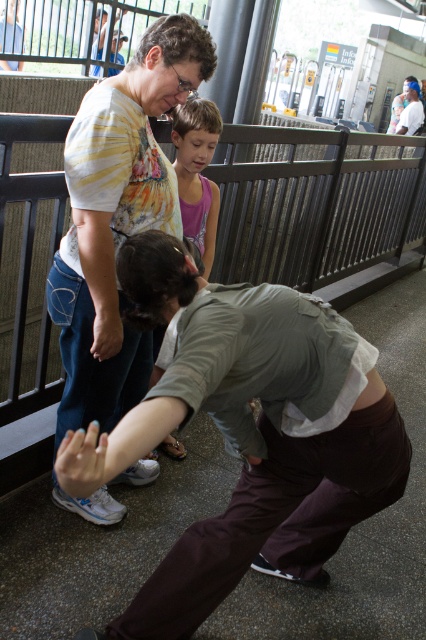
Question: Which of these objects is positioned farthest from the metallic gray fence at upper center?

Choices:
 (A) brown cotton pants at lower center
 (B) pink fabric shirt at center

Answer: (A)

Question: Where is metallic gray fence at upper center located in relation to pink fabric shirt at center in the image?

Choices:
 (A) right
 (B) left

Answer: (A)

Question: Which point is farther to the camera?

Choices:
 (A) striped cotton shirt at upper left
 (B) metallic gray fence at upper center

Answer: (B)

Question: Which point is closer to the camera?

Choices:
 (A) (178, 275)
 (B) (207, 115)

Answer: (A)

Question: Where is brown cotton pants at lower center located in relation to striped cotton shirt at upper left in the image?

Choices:
 (A) below
 (B) above

Answer: (A)

Question: Is the position of metallic gray fence at upper center less distant than that of pink fabric shirt at center?

Choices:
 (A) yes
 (B) no

Answer: (B)